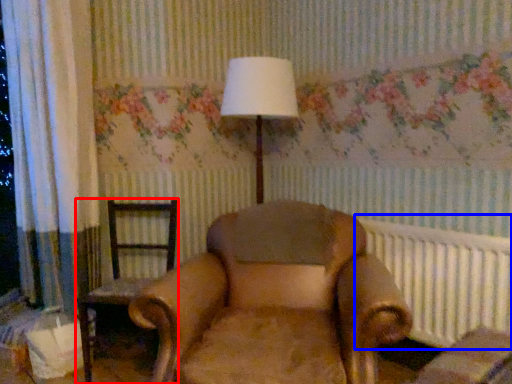
Question: Among these objects, which one is nearest to the camera, chair (highlighted by a red box) or radiator (highlighted by a blue box)?

Choices:
 (A) chair
 (B) radiator

Answer: (B)